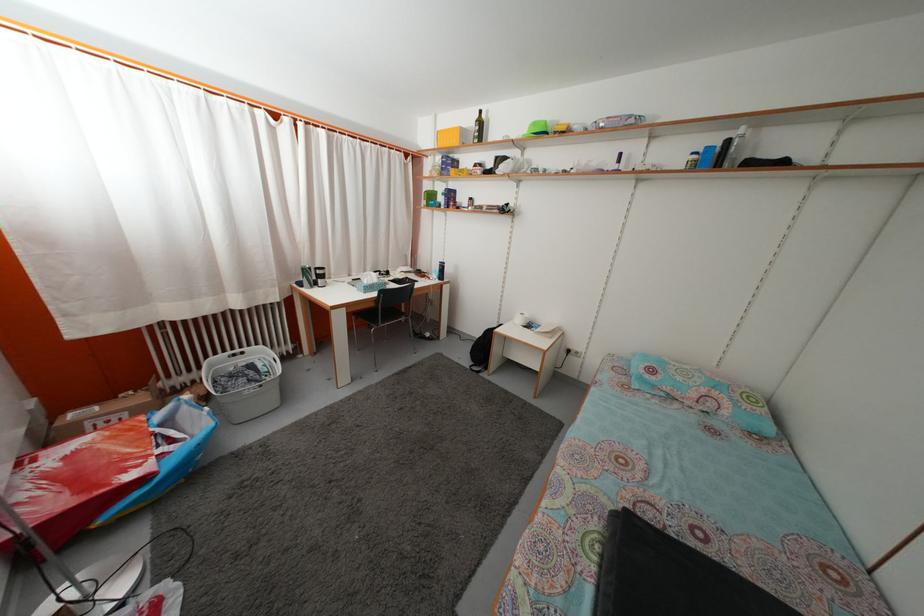
The width and height of the screenshot is (924, 616). In order to click on blue spray can in this screenshot , I will do `click(707, 156)`.